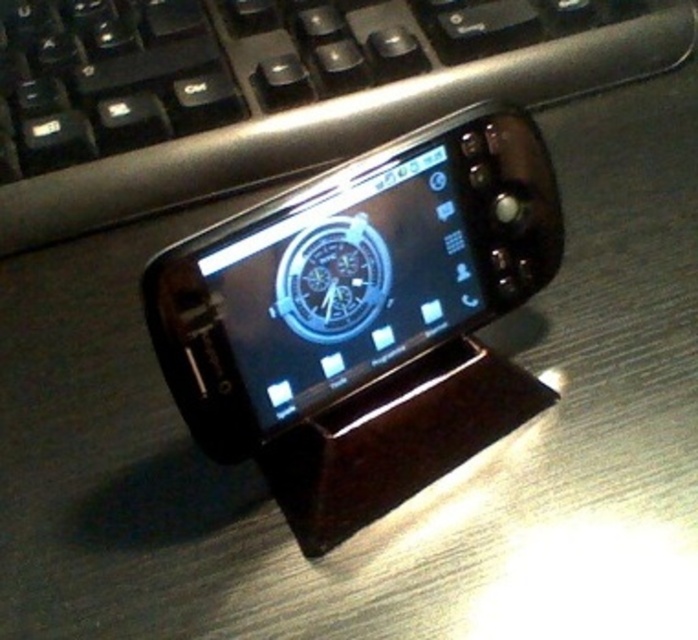
You are organizing your desk and want to move the satin black smartphone at center closer to the edge. However, there is a black plastic keyboard at upper center in the way. Can you slide the smartphone towards the edge without moving the keyboard?

The black plastic keyboard at upper center is above the satin black smartphone at center, so sliding the smartphone towards the edge would require moving it under the keyboard. Since the keyboard is in the way, you cannot slide the smartphone towards the edge without moving the keyboard.

You are setting up a workspace and want to place a new mouse between the black plastic keyboard at upper center and the satin black smartphone at center. Based on their widths, can the mouse fit between them?

The black plastic keyboard at upper center might be wider than the satin black smartphone at center, so there might be enough space for the mouse between them.